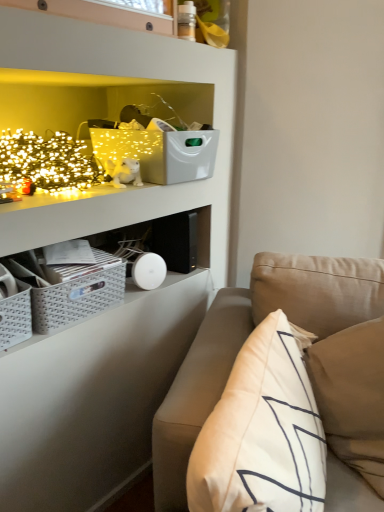
Question: Is gray woven crate at lower left completely or partially inside white soft pillow at right?

Choices:
 (A) yes
 (B) no

Answer: (B)

Question: Is white soft pillow at right smaller than gray woven crate at lower left?

Choices:
 (A) no
 (B) yes

Answer: (A)

Question: Is white soft pillow at right taller than gray woven crate at lower left?

Choices:
 (A) yes
 (B) no

Answer: (A)

Question: From the image's perspective, is white soft pillow at right located beneath gray woven crate at lower left?

Choices:
 (A) no
 (B) yes

Answer: (B)

Question: Is white soft pillow at right in front of gray woven crate at lower left?

Choices:
 (A) no
 (B) yes

Answer: (B)

Question: Looking at the image, does white plush cat at upper left seem bigger or smaller compared to white soft pillow at right?

Choices:
 (A) small
 (B) big

Answer: (A)

Question: In terms of width, does white plush cat at upper left look wider or thinner when compared to white soft pillow at right?

Choices:
 (A) thin
 (B) wide

Answer: (A)

Question: Is white plush cat at upper left spatially inside white soft pillow at right, or outside of it?

Choices:
 (A) inside
 (B) outside

Answer: (B)

Question: From the image's perspective, is white plush cat at upper left above or below white soft pillow at right?

Choices:
 (A) below
 (B) above

Answer: (B)

Question: Is white soft pillow at right in front of or behind beige fabric couch at lower right in the image?

Choices:
 (A) front
 (B) behind

Answer: (B)

Question: Which is correct: white soft pillow at right is inside beige fabric couch at lower right, or outside of it?

Choices:
 (A) outside
 (B) inside

Answer: (B)

Question: Considering the positions of white soft pillow at right and beige fabric couch at lower right in the image, is white soft pillow at right taller or shorter than beige fabric couch at lower right?

Choices:
 (A) short
 (B) tall

Answer: (B)

Question: From the image's perspective, is white soft pillow at right above or below beige fabric couch at lower right?

Choices:
 (A) below
 (B) above

Answer: (B)

Question: Is white plush cat at upper left to the left or to the right of beige fabric couch at lower right in the image?

Choices:
 (A) right
 (B) left

Answer: (B)

Question: Looking at their shapes, would you say white plush cat at upper left is wider or thinner than beige fabric couch at lower right?

Choices:
 (A) thin
 (B) wide

Answer: (A)